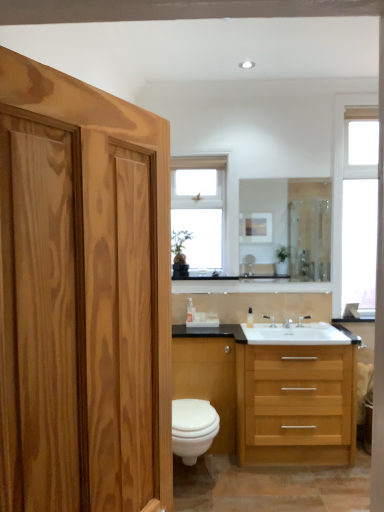
Question: Is white glossy toilet at lower center aimed at silver metallic faucet at sink right, which appears as the first faucet when viewed from the right?

Choices:
 (A) no
 (B) yes

Answer: (A)

Question: Does white glossy toilet at lower center have a lesser height compared to silver metallic faucet at sink right, marked as the second faucet in a left-to-right arrangement?

Choices:
 (A) yes
 (B) no

Answer: (B)

Question: Considering the relative sizes of white glossy toilet at lower center and silver metallic faucet at sink right, marked as the second faucet in a left-to-right arrangement, in the image provided, is white glossy toilet at lower center thinner than silver metallic faucet at sink right, marked as the second faucet in a left-to-right arrangement,?

Choices:
 (A) no
 (B) yes

Answer: (A)

Question: From a real-world perspective, is white glossy toilet at lower center below silver metallic faucet at sink right, marked as the second faucet in a left-to-right arrangement?

Choices:
 (A) yes
 (B) no

Answer: (A)

Question: Is white glossy toilet at lower center at the left side of silver metallic faucet at sink right, marked as the second faucet in a left-to-right arrangement?

Choices:
 (A) no
 (B) yes

Answer: (B)

Question: Visually, is clear glass window at upper center, acting as the 2th window starting from the right, positioned to the left or to the right of silver metallic faucet at sink right, which appears as the first faucet when viewed from the right?

Choices:
 (A) left
 (B) right

Answer: (A)

Question: Is point (182, 175) closer or farther from the camera than point (299, 320)?

Choices:
 (A) closer
 (B) farther

Answer: (B)

Question: In terms of width, does clear glass window at upper center, acting as the 2th window starting from the right, look wider or thinner when compared to silver metallic faucet at sink right, which appears as the first faucet when viewed from the right?

Choices:
 (A) wide
 (B) thin

Answer: (A)

Question: Is clear glass window at upper center, acting as the 2th window starting from the right, inside or outside of silver metallic faucet at sink right, marked as the second faucet in a left-to-right arrangement?

Choices:
 (A) inside
 (B) outside

Answer: (B)

Question: From a real-world perspective, is silver metallic faucet at sink right, which appears as the first faucet when viewed from the right, above or below white plastic soap dispenser at center?

Choices:
 (A) below
 (B) above

Answer: (A)

Question: Would you say silver metallic faucet at sink right, marked as the second faucet in a left-to-right arrangement, is inside or outside white plastic soap dispenser at center?

Choices:
 (A) outside
 (B) inside

Answer: (A)

Question: Considering their positions, is silver metallic faucet at sink right, which appears as the first faucet when viewed from the right, located in front of or behind white plastic soap dispenser at center?

Choices:
 (A) behind
 (B) front

Answer: (A)

Question: Visually, is silver metallic faucet at sink right, which appears as the first faucet when viewed from the right, positioned to the left or to the right of white plastic soap dispenser at center?

Choices:
 (A) right
 (B) left

Answer: (A)

Question: Considering the positions of white glossy cabinet at lower center and white plastic soap dispenser at center in the image, is white glossy cabinet at lower center wider or thinner than white plastic soap dispenser at center?

Choices:
 (A) thin
 (B) wide

Answer: (B)

Question: From a real-world perspective, relative to white plastic soap dispenser at center, is white glossy cabinet at lower center vertically above or below?

Choices:
 (A) above
 (B) below

Answer: (B)